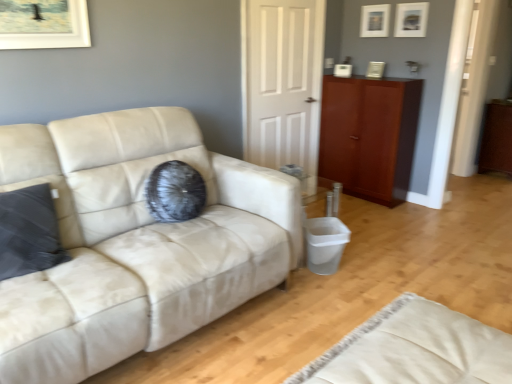
The image size is (512, 384). Identify the location of suede off-white couch at left. (135, 242).

What do you see at coordinates (369, 135) in the screenshot? This screenshot has height=384, width=512. I see `mahogany wood cabinet at right` at bounding box center [369, 135].

This screenshot has height=384, width=512. I want to click on white matte door at center, so click(x=282, y=83).

Is suede off-white couch at left to the left or to the right of brown wood dresser at right in the image?

In the image, suede off-white couch at left appears on the left side of brown wood dresser at right.

From the image's perspective, is suede off-white couch at left on top of brown wood dresser at right?

Incorrect, from the image's perspective, suede off-white couch at left is lower than brown wood dresser at right.

Is suede off-white couch at left positioned beyond the bounds of brown wood dresser at right?

suede off-white couch at left is positioned outside brown wood dresser at right.

Consider the image. Considering the sizes of suede off-white couch at left and brown wood dresser at right in the image, is suede off-white couch at left taller or shorter than brown wood dresser at right?

In the image, suede off-white couch at left appears to be taller than brown wood dresser at right.

From the image's perspective, is mahogany wood cabinet at right below suede off-white couch at left?

No.

Is suede off-white couch at left completely or partially inside mahogany wood cabinet at right?

Actually, suede off-white couch at left is outside mahogany wood cabinet at right.

Is mahogany wood cabinet at right smaller than suede off-white couch at left?

Yes.

From their relative heights in the image, would you say mahogany wood cabinet at right is taller or shorter than suede off-white couch at left?

mahogany wood cabinet at right is taller than suede off-white couch at left.

Is mahogany wood cabinet at right bigger than beige fabric rug at lower right?

Correct, mahogany wood cabinet at right is larger in size than beige fabric rug at lower right.

Are mahogany wood cabinet at right and beige fabric rug at lower right far apart?

Indeed, mahogany wood cabinet at right is not near beige fabric rug at lower right.

Considering the relative sizes of mahogany wood cabinet at right and beige fabric rug at lower right in the image provided, is mahogany wood cabinet at right shorter than beige fabric rug at lower right?

No.

Can you confirm if mahogany wood cabinet at right is wider than beige fabric rug at lower right?

No.

Which point is more forward, (371, 15) or (417, 29)?

The point (417, 29) is closer.

Considering the positions of objects matte white picture frame at upper right, arranged as the second picture frame when viewed from the right, and matte white picture frame at upper center, placed as the second picture frame when sorted from left to right, in the image provided, who is in front, matte white picture frame at upper right, arranged as the second picture frame when viewed from the right, or matte white picture frame at upper center, placed as the second picture frame when sorted from left to right,?

matte white picture frame at upper center, placed as the second picture frame when sorted from left to right.

From a real-world perspective, is matte white picture frame at upper right, the 1th picture frame viewed from the left, beneath matte white picture frame at upper center, acting as the first picture frame starting from the front?

Incorrect, from a real-world perspective, matte white picture frame at upper right, the 1th picture frame viewed from the left, is higher than matte white picture frame at upper center, acting as the first picture frame starting from the front.

Could you tell me if matte white picture frame at upper right, which is counted as the first picture frame, starting from the back, is facing matte white picture frame at upper center, acting as the first picture frame starting from the front?

No, matte white picture frame at upper right, which is counted as the first picture frame, starting from the back, is not oriented towards matte white picture frame at upper center, acting as the first picture frame starting from the front.

Considering the sizes of matte white picture frame at upper center, acting as the first picture frame starting from the front, and white matte door at center in the image, is matte white picture frame at upper center, acting as the first picture frame starting from the front, wider or thinner than white matte door at center?

In the image, matte white picture frame at upper center, acting as the first picture frame starting from the front, appears to be wider than white matte door at center.

Is matte white picture frame at upper center, placed as the second picture frame when sorted from left to right, not close to white matte door at center?

Yes.

This screenshot has width=512, height=384. Find the location of `door below the matte white picture frame at upper center, the second picture frame in the back-to-front sequence (from a real-world perspective)`. door below the matte white picture frame at upper center, the second picture frame in the back-to-front sequence (from a real-world perspective) is located at coordinates (282, 83).

Is matte white picture frame at upper center, the second picture frame in the back-to-front sequence, to the right of white matte door at center from the viewer's perspective?

Correct, you'll find matte white picture frame at upper center, the second picture frame in the back-to-front sequence, to the right of white matte door at center.

From a real-world perspective, which is physically below, mahogany wood cabinet at right or matte white picture frame at upper right, arranged as the second picture frame when viewed from the right?

From a 3D spatial view, mahogany wood cabinet at right is below.

Looking at this image, is matte white picture frame at upper right, the 1th picture frame viewed from the left, located within mahogany wood cabinet at right?

No.

You are a GUI agent. You are given a task and a screenshot of the screen. Output one action in this format:
    pyautogui.click(x=<x>, y=<y>)
    Task: Click on the cabinetry below the matte white picture frame at upper right, which is counted as the first picture frame, starting from the back (from a real-world perspective)
    The height and width of the screenshot is (384, 512).
    Given the screenshot: What is the action you would take?
    pyautogui.click(x=369, y=135)

Which object is further away from the camera, mahogany wood cabinet at right or matte white picture frame at upper right, arranged as the second picture frame when viewed from the right?

matte white picture frame at upper right, arranged as the second picture frame when viewed from the right, is more distant.

Which object is more forward, beige fabric rug at lower right or matte white picture frame at upper right, which is the 2th picture frame from front to back?

beige fabric rug at lower right.

Which of these two, beige fabric rug at lower right or matte white picture frame at upper right, arranged as the second picture frame when viewed from the right, is bigger?

beige fabric rug at lower right is bigger.

Are beige fabric rug at lower right and matte white picture frame at upper right, which is counted as the first picture frame, starting from the back, located far from each other?

Indeed, beige fabric rug at lower right is not near matte white picture frame at upper right, which is counted as the first picture frame, starting from the back.

How different are the orientations of beige fabric rug at lower right and matte white picture frame at upper right, which is counted as the first picture frame, starting from the back, in degrees?

178 degrees.

This screenshot has height=384, width=512. Identify the location of dresser that is behind the suede off-white couch at left. (497, 138).

What are the coordinates of `studio couch to the left of mahogany wood cabinet at right` in the screenshot? It's located at (135, 242).

When comparing their distances from matte white picture frame at upper center, the second picture frame in the back-to-front sequence, does mahogany wood cabinet at right or brown wood dresser at right seem further?

The object further to matte white picture frame at upper center, the second picture frame in the back-to-front sequence, is brown wood dresser at right.

Estimate the real-world distances between objects in this image. Which object is closer to matte white picture frame at upper right, which is the 2th picture frame from front to back, white matte door at center or brown wood dresser at right?

white matte door at center.

Considering their positions, is matte white picture frame at upper center, the second picture frame in the back-to-front sequence, positioned further to white matte door at center than brown wood dresser at right?

brown wood dresser at right is positioned further to the anchor white matte door at center.

Estimate the real-world distances between objects in this image. Which object is closer to matte white picture frame at upper center, acting as the first picture frame starting from the front, beige fabric rug at lower right or mahogany wood cabinet at right?

The object closer to matte white picture frame at upper center, acting as the first picture frame starting from the front, is mahogany wood cabinet at right.

Which object lies further to the anchor point white matte door at center, matte white picture frame at upper right, arranged as the second picture frame when viewed from the right, or suede off-white couch at left?

suede off-white couch at left is positioned further to the anchor white matte door at center.

From the image, which object appears to be farther from mahogany wood cabinet at right, beige fabric rug at lower right or brown wood dresser at right?

beige fabric rug at lower right is positioned further to the anchor mahogany wood cabinet at right.

When comparing their distances from suede off-white couch at left, does mahogany wood cabinet at right or matte white picture frame at upper right, which is counted as the first picture frame, starting from the back, seem closer?

mahogany wood cabinet at right is closer to suede off-white couch at left.

Looking at the image, which one is located further to matte white picture frame at upper center, placed as the second picture frame when sorted from left to right, suede off-white couch at left or beige fabric rug at lower right?

The object further to matte white picture frame at upper center, placed as the second picture frame when sorted from left to right, is beige fabric rug at lower right.

Identify the location of cabinetry between beige fabric rug at lower right and brown wood dresser at right along the z-axis. (369, 135).

The image size is (512, 384). Find the location of `cabinetry between white matte door at center and matte white picture frame at upper center, the second picture frame in the back-to-front sequence`. cabinetry between white matte door at center and matte white picture frame at upper center, the second picture frame in the back-to-front sequence is located at coordinates (369, 135).

At what (x,y) coordinates should I click in order to perform the action: click on studio couch between beige fabric rug at lower right and matte white picture frame at upper right, which is the 2th picture frame from front to back, in the front-back direction. Please return your answer as a coordinate pair (x, y). Image resolution: width=512 pixels, height=384 pixels. Looking at the image, I should click on (135, 242).

The height and width of the screenshot is (384, 512). I want to click on cabinetry positioned between beige fabric rug at lower right and matte white picture frame at upper center, placed as the second picture frame when sorted from left to right, from near to far, so click(369, 135).